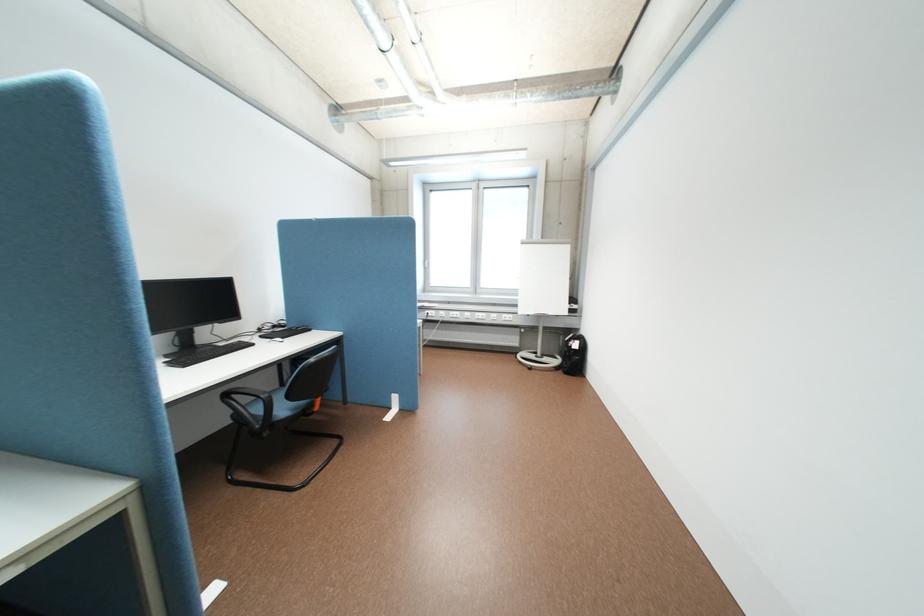
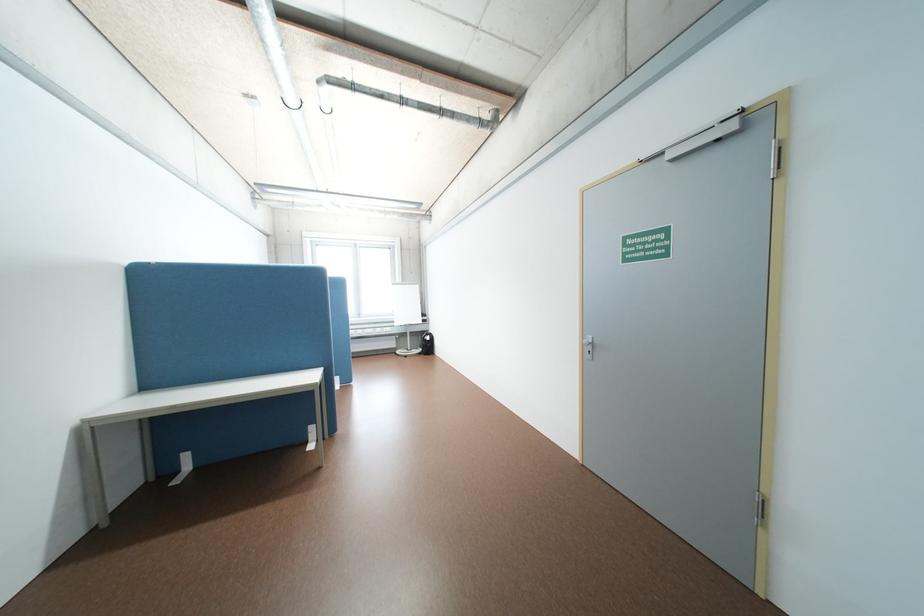
In the second image, find the point that corresponds to (x=567, y=368) in the first image.

(431, 353)